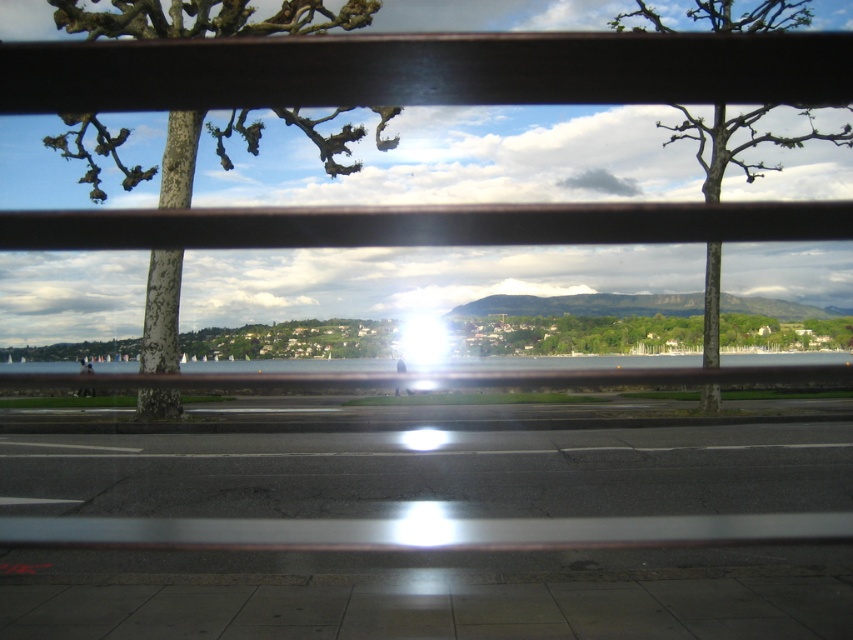
Is green rough bark tree at left below bare wood tree at center?

Yes, green rough bark tree at left is below bare wood tree at center.

Between green rough bark tree at left and bare wood tree at center, which one is positioned lower?

green rough bark tree at left is lower down.

Who is more forward, (149, 353) or (724, 0)?

Point (149, 353)

Where is `green rough bark tree at left`? This screenshot has height=640, width=853. green rough bark tree at left is located at coordinates coord(206,19).

In the scene shown: Measure the distance between bare wood tree at center and clear water at center.

They are 8.80 meters apart.

Does bare wood tree at center have a greater width compared to clear water at center?

In fact, bare wood tree at center might be narrower than clear water at center.

This screenshot has height=640, width=853. I want to click on bare wood tree at center, so click(x=741, y=141).

Is green rough bark tree at left behind clear water at center?

No, it is in front of clear water at center.

Based on the photo, can you confirm if green rough bark tree at left is positioned above clear water at center?

Yes, green rough bark tree at left is above clear water at center.

Is point (154, 33) less distant than point (477, 364)?

Yes, point (154, 33) is in front of point (477, 364).

Identify the location of green rough bark tree at left. This screenshot has height=640, width=853. (206, 19).